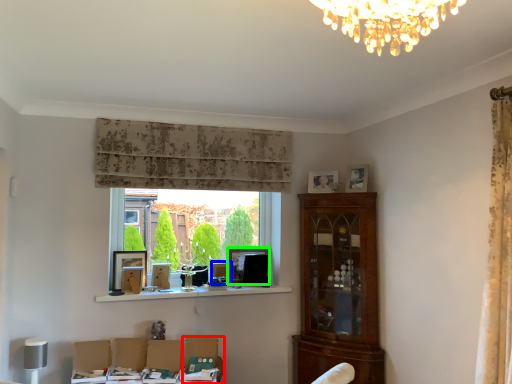
Question: Based on their relative distances, which object is farther from swivel chair (highlighted by a red box)? Choose from picture frame (highlighted by a blue box) and picture frame (highlighted by a green box).

Choices:
 (A) picture frame
 (B) picture frame

Answer: (B)